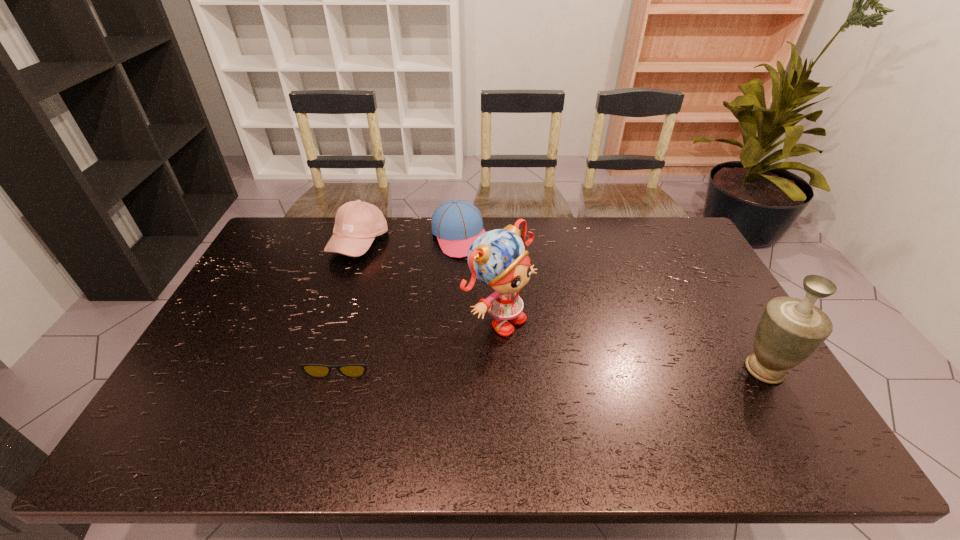
You are a GUI agent. You are given a task and a screenshot of the screen. Output one action in this format:
    pyautogui.click(x=<x>, y=<y>)
    Task: Click on the free spot on the desktop that is between the shortest object and the rightmost object and is positioned on the face of the doll
    The image size is (960, 540).
    Given the screenshot: What is the action you would take?
    pyautogui.click(x=577, y=367)

You are a GUI agent. You are given a task and a screenshot of the screen. Output one action in this format:
    pyautogui.click(x=<x>, y=<y>)
    Task: Click on the vacant space on the desktop that is between the sunglasses and the urn and is positioned on the front-facing side of the shorter baseball cap
    
    Given the screenshot: What is the action you would take?
    pyautogui.click(x=538, y=366)

The width and height of the screenshot is (960, 540). I want to click on vacant space on the desktop that is between the sunglasses and the rightmost object and is positioned on the front-facing side of the left baseball cap, so click(x=498, y=366).